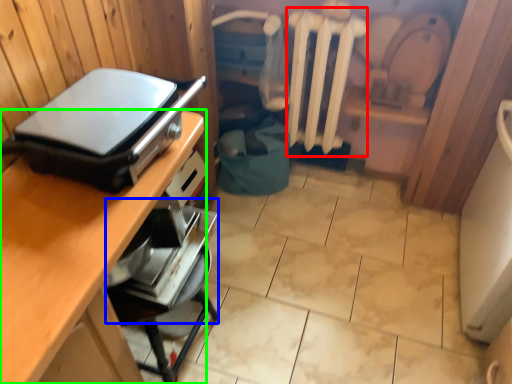
Question: Estimate the real-world distances between objects in this image. Which object is farther from radiator (highlighted by a red box), appliance (highlighted by a blue box) or desk (highlighted by a green box)?

Choices:
 (A) appliance
 (B) desk

Answer: (B)